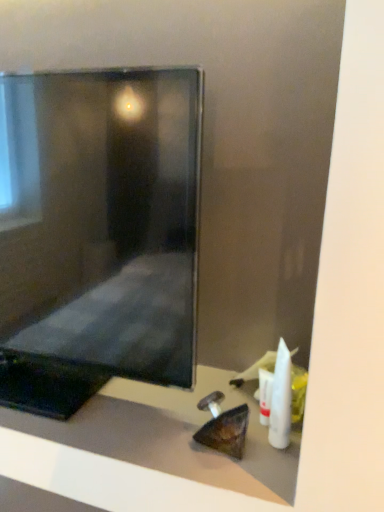
Identify the location of free point above matte black monitor at center (from a real-world perspective). (138, 409).